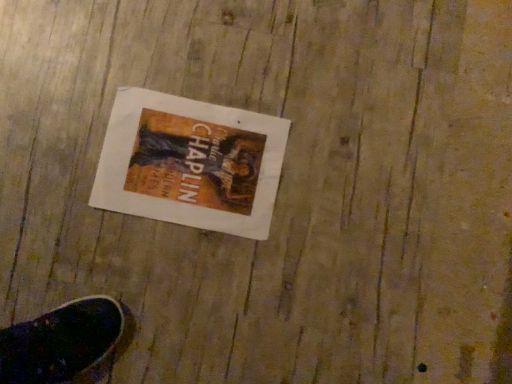
Locate an element on the screen. white paper flyer at center is located at coordinates (190, 163).

Describe the element at coordinates (190, 163) in the screenshot. I see `white paper flyer at center` at that location.

The height and width of the screenshot is (384, 512). Find the location of `white paper flyer at center`. white paper flyer at center is located at coordinates (190, 163).